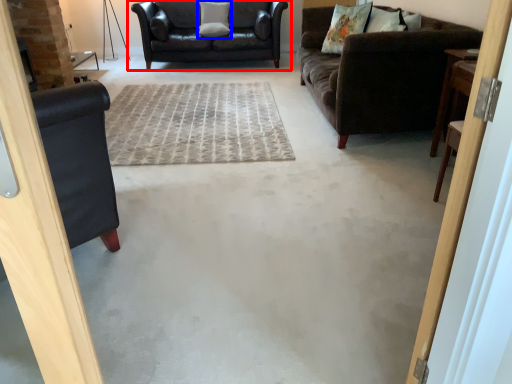
Question: Which object is further to the camera taking this photo, studio couch (highlighted by a red box) or pillow (highlighted by a blue box)?

Choices:
 (A) studio couch
 (B) pillow

Answer: (B)